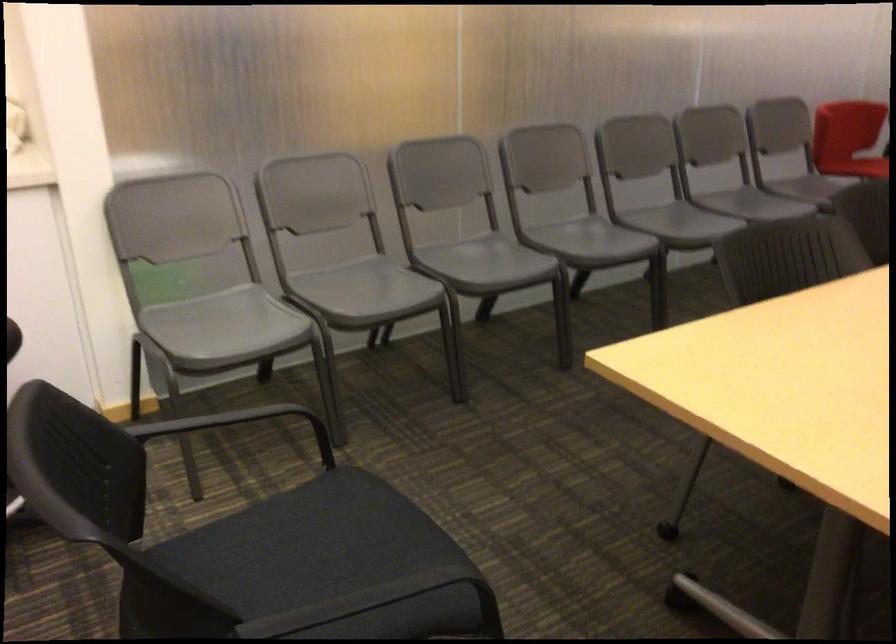
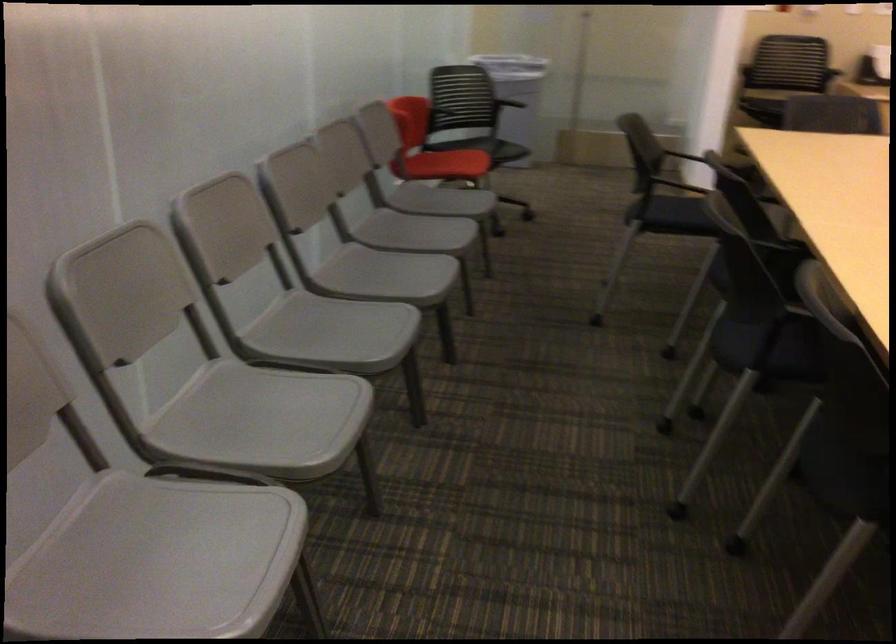
Locate, in the second image, the point that corresponds to point (495, 259) in the first image.

(263, 420)